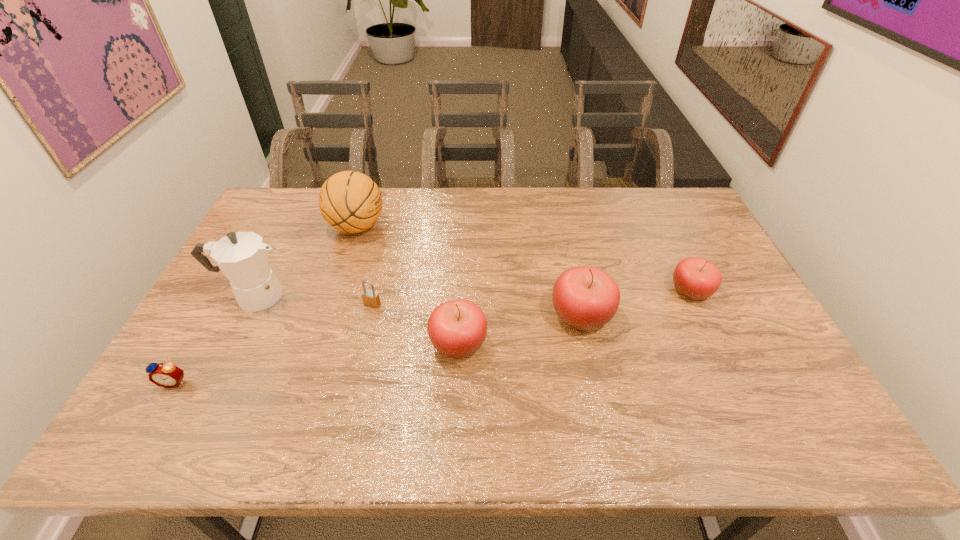
Find the location of a particular element. The width and height of the screenshot is (960, 540). object at the near left corner is located at coordinates (168, 375).

You are a GUI agent. You are given a task and a screenshot of the screen. Output one action in this format:
    pyautogui.click(x=<x>, y=<y>)
    Task: Click on the vacant region at the far edge
    The image size is (960, 540).
    Given the screenshot: What is the action you would take?
    pyautogui.click(x=619, y=206)

Image resolution: width=960 pixels, height=540 pixels. I want to click on vacant space at the near edge of the desktop, so click(470, 394).

Find the location of a particular element. vacant space at the left edge of the desktop is located at coordinates (208, 325).

Image resolution: width=960 pixels, height=540 pixels. In the image, there is a desktop. In order to click on free space at the right edge in this screenshot , I will do `click(699, 235)`.

In the image, there is a desktop. Where is `vacant space at the far left corner`? The height and width of the screenshot is (540, 960). vacant space at the far left corner is located at coordinates (303, 211).

You are a GUI agent. You are given a task and a screenshot of the screen. Output one action in this format:
    pyautogui.click(x=<x>, y=<y>)
    Task: Click on the blank space at the near right corner
    This screenshot has height=540, width=960.
    Given the screenshot: What is the action you would take?
    [739, 377]

The image size is (960, 540). I want to click on blank region between the second tallest apple and the padlock, so click(x=416, y=324).

Identify the location of free point between the leftmost apple and the basketball. Image resolution: width=960 pixels, height=540 pixels. (408, 286).

Where is `vacant space that's between the padlock and the third object from right to left`? vacant space that's between the padlock and the third object from right to left is located at coordinates (416, 324).